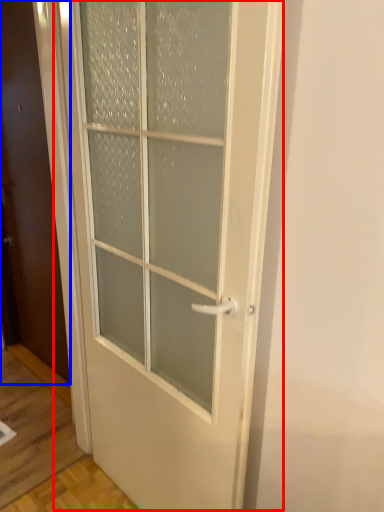
Question: Which object is further to the camera taking this photo, door (highlighted by a red box) or door (highlighted by a blue box)?

Choices:
 (A) door
 (B) door

Answer: (B)